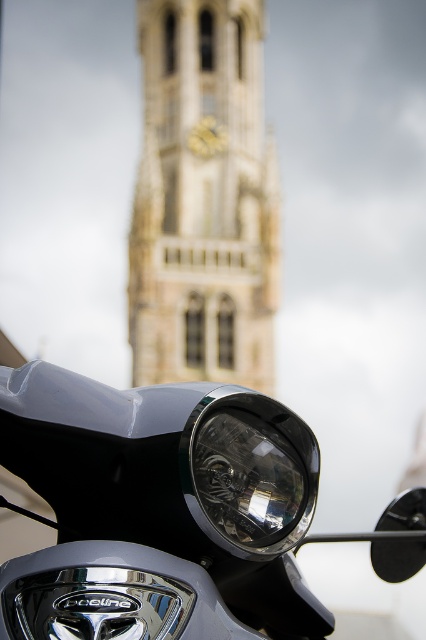
Question: Among these objects, which one is farthest from the camera?

Choices:
 (A) clear glass headlight at center
 (B) satin silver headlight at center

Answer: (A)

Question: Which object appears closest to the camera in this image?

Choices:
 (A) stone clock tower at center
 (B) satin silver headlight at center
 (C) clear glass headlight at center

Answer: (B)

Question: Can you confirm if satin silver headlight at center is thinner than stone clock tower at center?

Choices:
 (A) no
 (B) yes

Answer: (A)

Question: Is satin silver headlight at center thinner than stone clock tower at center?

Choices:
 (A) yes
 (B) no

Answer: (B)

Question: Among these objects, which one is farthest from the camera?

Choices:
 (A) satin silver headlight at center
 (B) clear glass headlight at center
 (C) stone clock tower at center

Answer: (C)

Question: Does satin silver headlight at center have a smaller size compared to clear glass headlight at center?

Choices:
 (A) yes
 (B) no

Answer: (B)